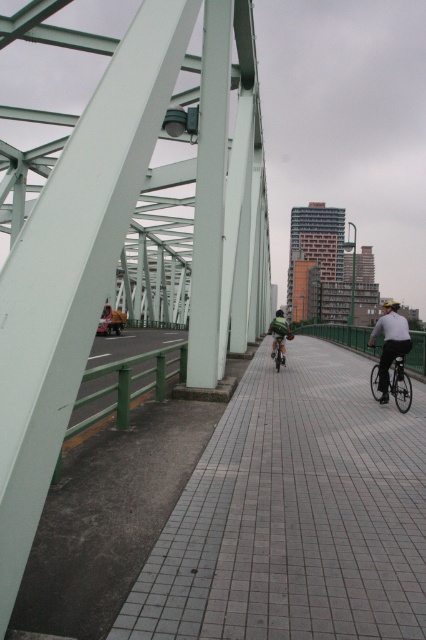
You are standing on the bridge and want to walk towards the green matte jacket at center. Is the smooth concrete sidewalk at center long enough to reach the jacket?

The smooth concrete sidewalk at center is shorter than the green matte jacket at center, so it might not be long enough to reach the jacket. Consider taking an alternative path or checking the distance carefully.

Looking at this image, you are standing at the point marked as point (294, 515) on the bridge. What material is the surface you are standing on made of?

The surface at point (294, 515) is smooth concrete sidewalk at center.